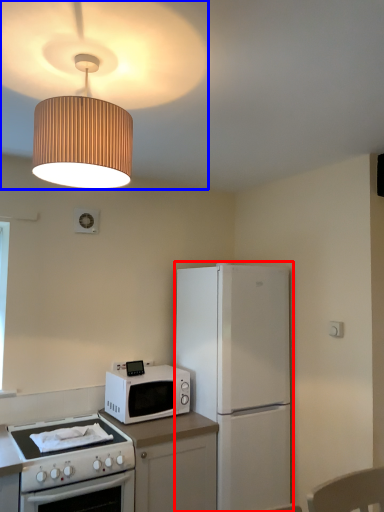
Question: Which object appears closest to the camera in this image, refrigerator (highlighted by a red box) or lamp (highlighted by a blue box)?

Choices:
 (A) refrigerator
 (B) lamp

Answer: (B)